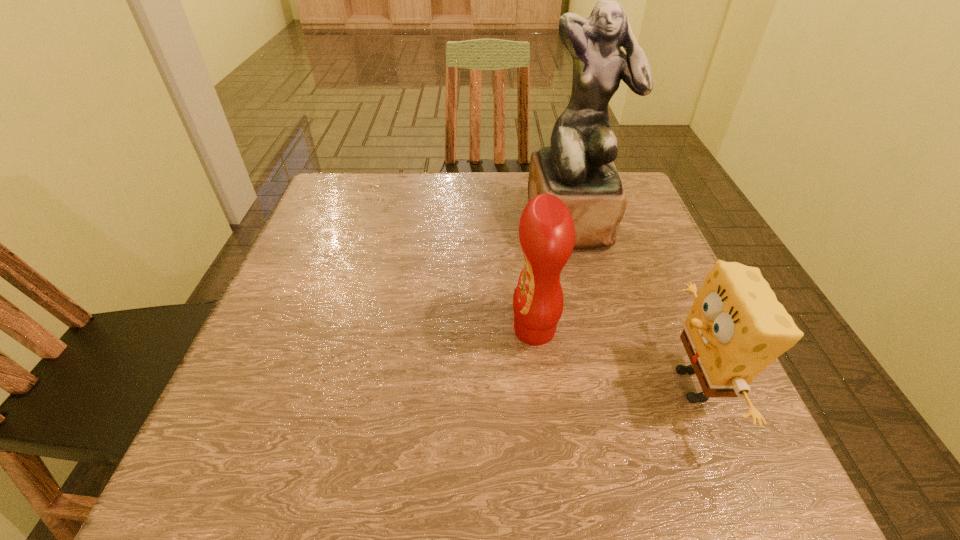
Image resolution: width=960 pixels, height=540 pixels. Identify the location of free spot located on the face of the shortest object. [474, 385].

Where is `object situated at the far edge`? This screenshot has height=540, width=960. object situated at the far edge is located at coordinates (577, 167).

Where is `object at the near edge`? The image size is (960, 540). object at the near edge is located at coordinates (736, 327).

This screenshot has width=960, height=540. Identify the location of sculpture that is at the right edge. (577, 167).

At what (x,y) coordinates should I click in order to perform the action: click on sponge situated at the right edge. Please return your answer as a coordinate pair (x, y). This screenshot has height=540, width=960. Looking at the image, I should click on (736, 327).

Locate an element on the screen. The height and width of the screenshot is (540, 960). object situated at the far right corner is located at coordinates (577, 167).

I want to click on object located at the near right corner, so click(x=736, y=327).

Where is `vacant space at the far edge of the desktop`? This screenshot has height=540, width=960. vacant space at the far edge of the desktop is located at coordinates (463, 207).

At what (x,y) coordinates should I click in order to perform the action: click on vacant space at the near edge. Please return your answer as a coordinate pair (x, y). Looking at the image, I should click on (329, 491).

Locate an element on the screen. This screenshot has height=540, width=960. free space at the right edge of the desktop is located at coordinates (643, 324).